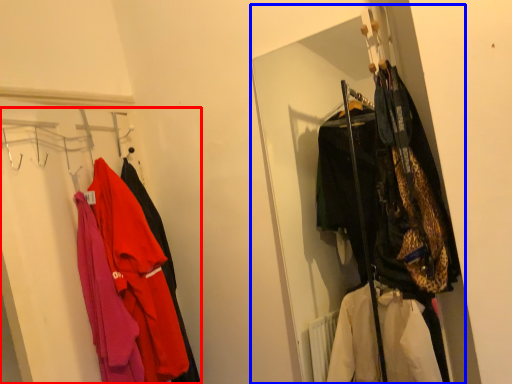
Question: Which of the following is the closest to the observer, closet (highlighted by a red box) or closet (highlighted by a blue box)?

Choices:
 (A) closet
 (B) closet

Answer: (B)